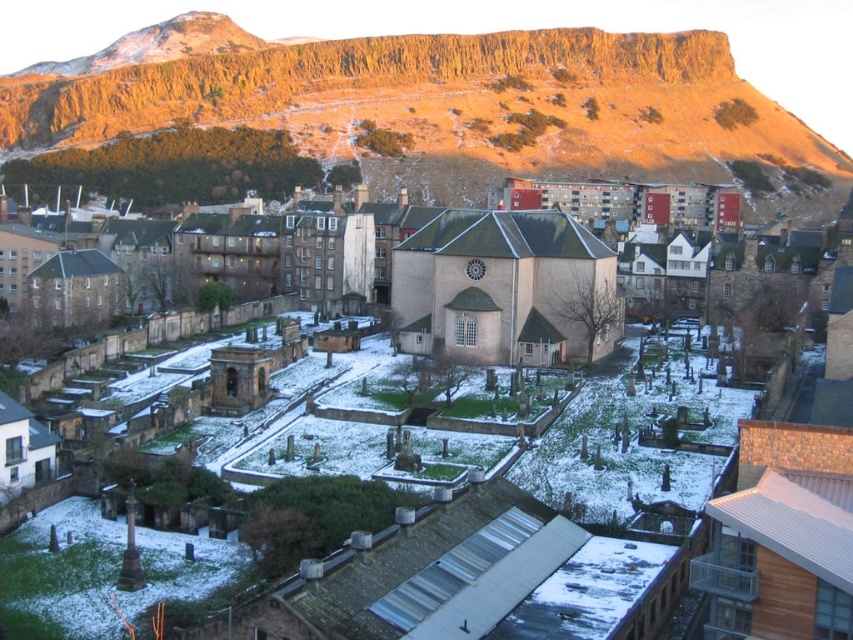
Between golden rock formation at upper center and white stone church at center, which one has less height?

white stone church at center is shorter.

From the picture: Between golden rock formation at upper center and white stone church at center, which one is positioned lower?

white stone church at center is lower down.

Locate an element on the screen. The width and height of the screenshot is (853, 640). golden rock formation at upper center is located at coordinates (428, 97).

At what (x,y) coordinates should I click in order to perform the action: click on golden rock formation at upper center. Please return your answer as a coordinate pair (x, y). The width and height of the screenshot is (853, 640). Looking at the image, I should click on (428, 97).

Who is positioned more to the right, golden rock formation at upper center or smooth stone church at center?

Positioned to the right is smooth stone church at center.

Does golden rock formation at upper center appear under smooth stone church at center?

Incorrect, golden rock formation at upper center is not positioned below smooth stone church at center.

This screenshot has width=853, height=640. In order to click on golden rock formation at upper center in this screenshot , I will do `click(428, 97)`.

Which is more to the left, white stone church at center or smooth stone church at center?

From the viewer's perspective, smooth stone church at center appears more on the left side.

Does white stone church at center appear on the right side of smooth stone church at center?

Indeed, white stone church at center is positioned on the right side of smooth stone church at center.

You are a GUI agent. You are given a task and a screenshot of the screen. Output one action in this format:
    pyautogui.click(x=<x>, y=<y>)
    Task: Click on the white stone church at center
    This screenshot has width=853, height=640.
    Given the screenshot: What is the action you would take?
    pyautogui.click(x=480, y=568)